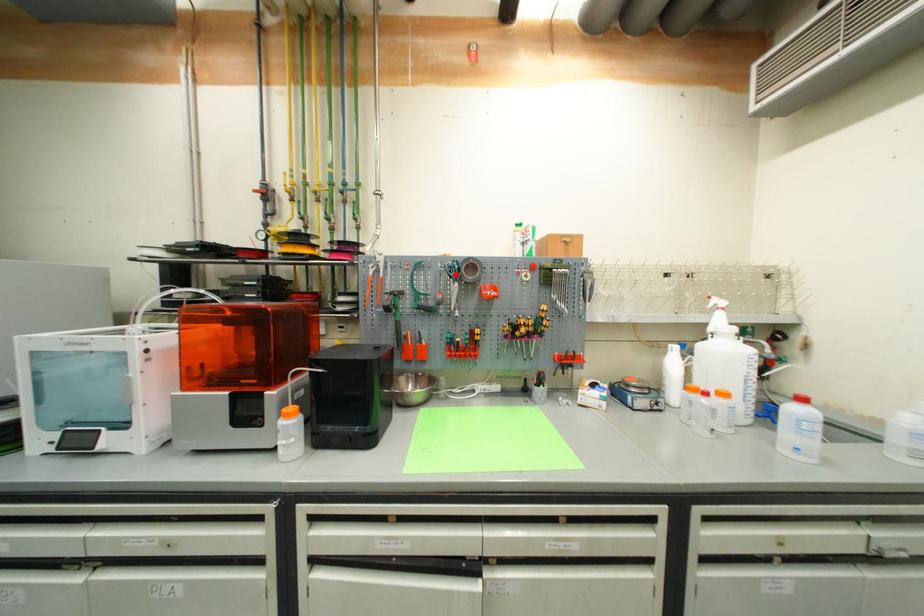
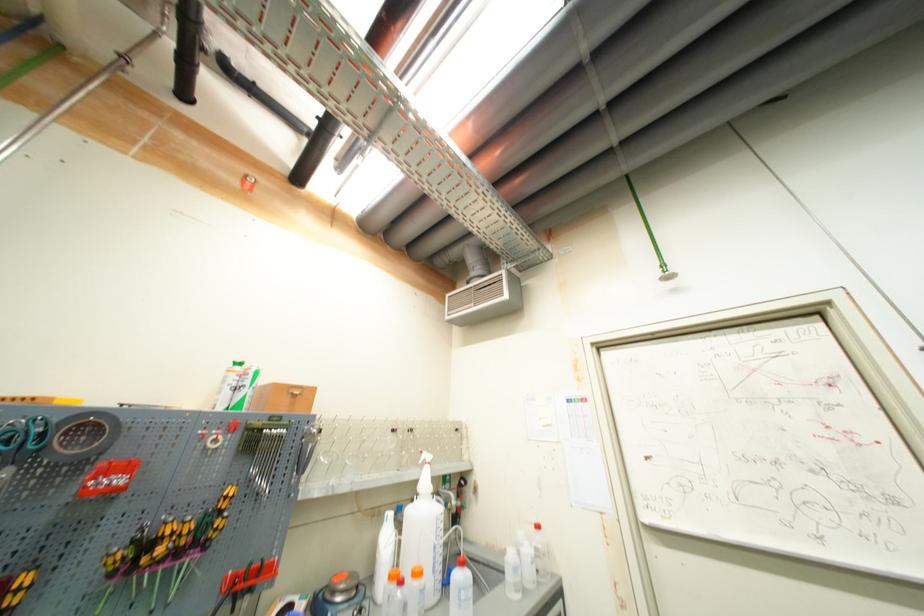
Question: I am providing you with two images of the same scene from different viewpoints. A red point is marked on the first image. Can you still see the location of the red point in image 2?

Choices:
 (A) Yes
 (B) No

Answer: (A)